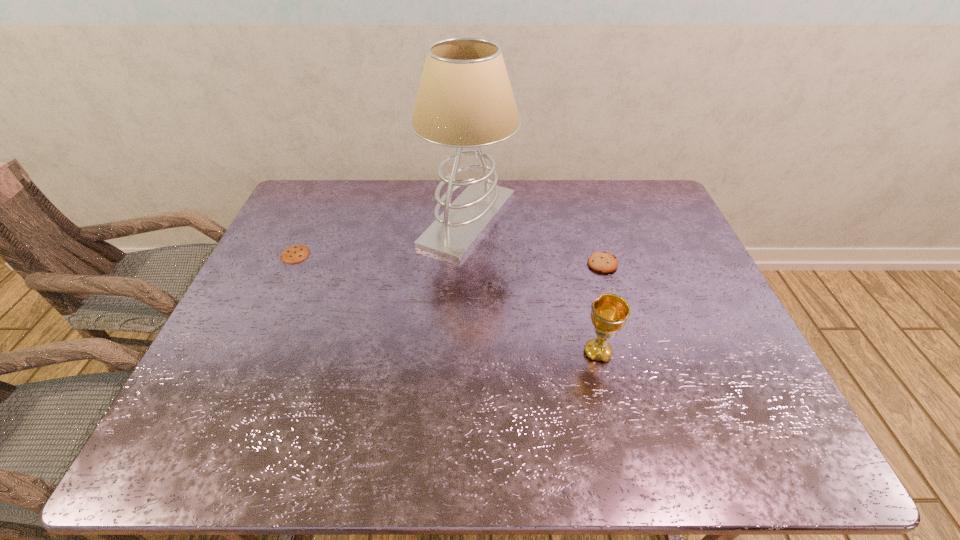
Locate an element on the screen. vacant point that satisfies the following two spatial constraints: 1. on the front side of the chalice; 2. on the left side of the second object from left to right is located at coordinates (464, 353).